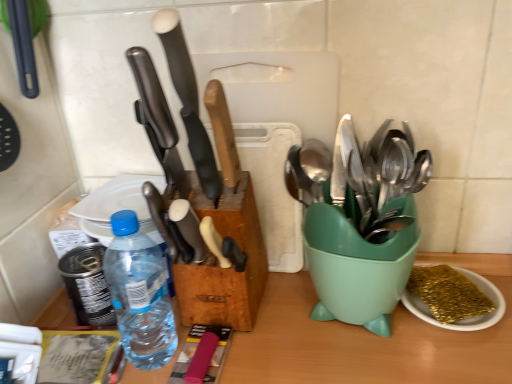
You are a GUI agent. You are given a task and a screenshot of the screen. Output one action in this format:
    pyautogui.click(x=<x>, y=<y>)
    Task: Click on the transparent plastic bottle at center
    The height and width of the screenshot is (384, 512).
    Given the screenshot: What is the action you would take?
    point(140,293)

The height and width of the screenshot is (384, 512). Find the location of `wooden-handled knife at center, acting as the 3th kitchen knife starting from the left`. wooden-handled knife at center, acting as the 3th kitchen knife starting from the left is located at coordinates (223, 133).

Describe the element at coordinates (157, 121) in the screenshot. Image resolution: width=512 pixels, height=384 pixels. I see `polished black knife at center, the first kitchen knife viewed from the left` at that location.

The image size is (512, 384). I want to click on polished black knife at center, the first kitchen knife viewed from the left, so click(157, 121).

The image size is (512, 384). Identify the location of gold glitter sponge at lower right. (466, 318).

Is the position of wooden-handled knife at center, arranged as the first kitchen knife when viewed from the right, less distant than that of white plastic plate at upper left?

Yes, it is.

Considering the relative sizes of wooden-handled knife at center, arranged as the first kitchen knife when viewed from the right, and white plastic plate at upper left in the image provided, is wooden-handled knife at center, arranged as the first kitchen knife when viewed from the right, thinner than white plastic plate at upper left?

Indeed, wooden-handled knife at center, arranged as the first kitchen knife when viewed from the right, has a lesser width compared to white plastic plate at upper left.

From the image's perspective, between wooden-handled knife at center, acting as the 3th kitchen knife starting from the left, and white plastic plate at upper left, which one is located above?

wooden-handled knife at center, acting as the 3th kitchen knife starting from the left, appears higher in the image.

Can you confirm if wooden-handled knife at center, acting as the 3th kitchen knife starting from the left, is positioned to the right of white plastic plate at upper left?

Yes, wooden-handled knife at center, acting as the 3th kitchen knife starting from the left, is to the right of white plastic plate at upper left.

Is wooden-handled knife at center, acting as the 3th kitchen knife starting from the left, positioned in front of gold glitter sponge at lower right?

Yes.

Image resolution: width=512 pixels, height=384 pixels. In order to click on the 1st kitchen knife above when counting from the gold glitter sponge at lower right (from the image's perspective) in this screenshot , I will do `click(223, 133)`.

Could you measure the distance between wooden-handled knife at center, acting as the 3th kitchen knife starting from the left, and gold glitter sponge at lower right?

They are 13.61 inches apart.

Considering the relative sizes of wooden-handled knife at center, acting as the 3th kitchen knife starting from the left, and gold glitter sponge at lower right in the image provided, is wooden-handled knife at center, acting as the 3th kitchen knife starting from the left, smaller than gold glitter sponge at lower right?

Indeed, wooden-handled knife at center, acting as the 3th kitchen knife starting from the left, has a smaller size compared to gold glitter sponge at lower right.

Can you confirm if white plastic plate at upper left is thinner than gold glitter sponge at lower right?

No.

From their relative heights in the image, would you say white plastic plate at upper left is taller or shorter than gold glitter sponge at lower right?

Considering their sizes, white plastic plate at upper left has less height than gold glitter sponge at lower right.

Would you say white plastic plate at upper left is outside gold glitter sponge at lower right?

Yes.

Considering the positions of point (143, 179) and point (411, 297), is point (143, 179) closer or farther from the camera than point (411, 297)?

Clearly, point (143, 179) is more distant from the camera than point (411, 297).

Which object is more forward, transparent plastic bottle at center or white plastic plate at upper left?

transparent plastic bottle at center is more forward.

Is point (132, 230) less distant than point (111, 214)?

Yes, it is.

Is transparent plastic bottle at center oriented away from white plastic plate at upper left?

That's not correct — transparent plastic bottle at center is not looking away from white plastic plate at upper left.

Would you say transparent plastic bottle at center is inside or outside white plastic plate at upper left?

The correct answer is: outside.

In the scene shown: Between polished black knife at center, the first kitchen knife viewed from the left, and wooden-handled knife at center, arranged as the first kitchen knife when viewed from the right, which one has smaller size?

Smaller between the two is polished black knife at center, the first kitchen knife viewed from the left.

From the image's perspective, is polished black knife at center, the first kitchen knife viewed from the left, over wooden-handled knife at center, arranged as the first kitchen knife when viewed from the right?

Correct, polished black knife at center, the first kitchen knife viewed from the left, appears higher than wooden-handled knife at center, arranged as the first kitchen knife when viewed from the right, in the image.

Is wooden-handled knife at center, arranged as the first kitchen knife when viewed from the right, at the back of polished black knife at center, acting as the third kitchen knife starting from the right?

That's not correct — polished black knife at center, acting as the third kitchen knife starting from the right, is not looking away from wooden-handled knife at center, arranged as the first kitchen knife when viewed from the right.

Which object is thinner, polished black knife at center, acting as the third kitchen knife starting from the right, or wooden-handled knife at center, arranged as the first kitchen knife when viewed from the right?

With smaller width is wooden-handled knife at center, arranged as the first kitchen knife when viewed from the right.

From the image's perspective, which kitchen knife is the 1st one above the white plastic plate at upper left? Please provide its 2D coordinates.

[(223, 133)]

From a real-world perspective, does white plastic plate at upper left stand above wooden-handled knife at center, acting as the 3th kitchen knife starting from the left?

No, from a real-world perspective, white plastic plate at upper left is not over wooden-handled knife at center, acting as the 3th kitchen knife starting from the left

From the picture: What's the angular difference between white plastic plate at upper left and wooden-handled knife at center, acting as the 3th kitchen knife starting from the left,'s facing directions?

They differ by 88.9 degrees in their facing directions.

Which object is further away from the camera, white plastic plate at upper left or wooden-handled knife at center, acting as the 3th kitchen knife starting from the left?

white plastic plate at upper left is further away from the camera.

Can you see polished black knife at center, the first kitchen knife viewed from the left, touching matte black knife at center, which is the 2th kitchen knife from right to left?

Yes, polished black knife at center, the first kitchen knife viewed from the left, is with matte black knife at center, which is the 2th kitchen knife from right to left.

Is polished black knife at center, the first kitchen knife viewed from the left, further to camera compared to matte black knife at center, which is the 2th kitchen knife from right to left?

That is True.

Is point (147, 131) closer to viewer compared to point (216, 182)?

That is False.

From a real-world perspective, does polished black knife at center, the first kitchen knife viewed from the left, sit lower than matte black knife at center, which appears as the 2th kitchen knife when viewed from the left?

Yes, from a real-world perspective, polished black knife at center, the first kitchen knife viewed from the left, is under matte black knife at center, which appears as the 2th kitchen knife when viewed from the left.

At what (x,y) coordinates should I click in order to perform the action: click on the 2nd kitchen knife located above the white plastic plate at upper left (from a real-world perspective). Please return your answer as a coordinate pair (x, y). Image resolution: width=512 pixels, height=384 pixels. Looking at the image, I should click on (223, 133).

In the image, there is a wooden-handled knife at center, arranged as the first kitchen knife when viewed from the right. Where is `tableware below it (from the image's perspective)`? The width and height of the screenshot is (512, 384). tableware below it (from the image's perspective) is located at coordinates (466, 318).

Looking at the image, which one is located closer to gold glitter sponge at lower right, white plastic plate at upper left or transparent plastic bottle at center?

transparent plastic bottle at center is closer to gold glitter sponge at lower right.

Considering their positions, is gold glitter sponge at lower right positioned closer to green plastic spoon holder at right than polished black knife at center, acting as the third kitchen knife starting from the right?

Based on the image, gold glitter sponge at lower right appears to be nearer to green plastic spoon holder at right.

Looking at the image, which one is located further to white plastic plate at upper left, gold glitter sponge at lower right or transparent plastic bottle at center?

Among the two, gold glitter sponge at lower right is located further to white plastic plate at upper left.

Which object lies nearer to the anchor point transparent plastic bottle at center, green plastic spoon holder at right or wooden-handled knife at center, acting as the 3th kitchen knife starting from the left?

The object closer to transparent plastic bottle at center is wooden-handled knife at center, acting as the 3th kitchen knife starting from the left.

Considering their positions, is transparent plastic bottle at center positioned further to white plastic plate at upper left than polished black knife at center, acting as the third kitchen knife starting from the right?

The object further to white plastic plate at upper left is polished black knife at center, acting as the third kitchen knife starting from the right.

When comparing their distances from matte black knife at center, which appears as the 2th kitchen knife when viewed from the left, does green plastic spoon holder at right or white plastic plate at upper left seem further?

green plastic spoon holder at right is positioned further to the anchor matte black knife at center, which appears as the 2th kitchen knife when viewed from the left.

When comparing their distances from white plastic plate at upper left, does transparent plastic bottle at center or matte black knife at center, which is the 2th kitchen knife from right to left, seem closer?

Among the two, transparent plastic bottle at center is located nearer to white plastic plate at upper left.

When comparing their distances from green plastic spoon holder at right, does white plastic plate at upper left or gold glitter sponge at lower right seem closer?

Among the two, gold glitter sponge at lower right is located nearer to green plastic spoon holder at right.

Find the location of `bottle between wooden-handled knife at center, acting as the 3th kitchen knife starting from the left, and white plastic plate at upper left, along the z-axis`. bottle between wooden-handled knife at center, acting as the 3th kitchen knife starting from the left, and white plastic plate at upper left, along the z-axis is located at coordinates (140, 293).

Find the location of `mixing bowl located between polished black knife at center, acting as the third kitchen knife starting from the right, and gold glitter sponge at lower right in the left-right direction`. mixing bowl located between polished black knife at center, acting as the third kitchen knife starting from the right, and gold glitter sponge at lower right in the left-right direction is located at coordinates (356, 268).

The width and height of the screenshot is (512, 384). In order to click on mixing bowl between matte black knife at center, which is the 2th kitchen knife from right to left, and gold glitter sponge at lower right in this screenshot , I will do `click(356, 268)`.

The width and height of the screenshot is (512, 384). Find the location of `kitchen knife between matte black knife at center, which appears as the 2th kitchen knife when viewed from the left, and gold glitter sponge at lower right from left to right`. kitchen knife between matte black knife at center, which appears as the 2th kitchen knife when viewed from the left, and gold glitter sponge at lower right from left to right is located at coordinates (223, 133).